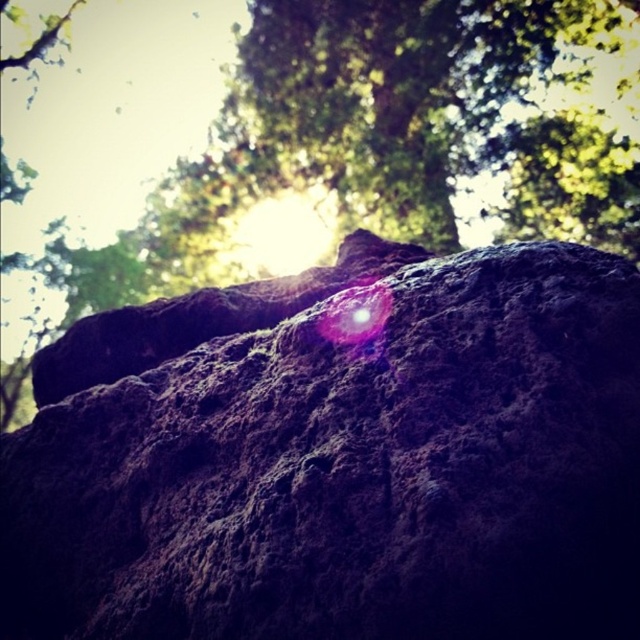
Does dark brown rough rock at center come in front of green rough bark at upper center?

Yes.

Can you confirm if dark brown rough rock at center is positioned above green rough bark at upper center?

No, dark brown rough rock at center is not above green rough bark at upper center.

Locate an element on the screen. The height and width of the screenshot is (640, 640). dark brown rough rock at center is located at coordinates (339, 456).